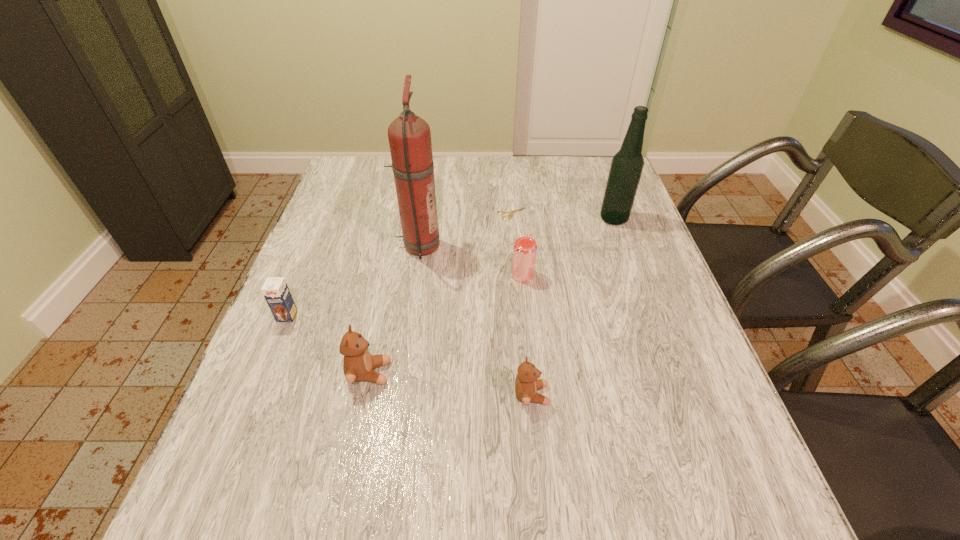
Identify the location of the left teddy bear. (358, 364).

Where is `the right teddy bear`? The width and height of the screenshot is (960, 540). the right teddy bear is located at coordinates (527, 384).

Identify the location of the leftmost object. Image resolution: width=960 pixels, height=540 pixels. (275, 290).

What are the coordinates of `the fifth farthest object` in the screenshot? It's located at (275, 290).

You are a GUI agent. You are given a task and a screenshot of the screen. Output one action in this format:
    pyautogui.click(x=<x>, y=<y>)
    Task: Click on the shears
    
    Given the screenshot: What is the action you would take?
    pyautogui.click(x=511, y=212)

Locate an element on the screen. The image size is (960, 540). the rightmost object is located at coordinates (627, 164).

Identify the location of alcohol. (627, 164).

Locate an element on the screen. Image resolution: width=960 pixels, height=540 pixels. the tallest object is located at coordinates (409, 136).

Find the location of a particular element. The width and height of the screenshot is (960, 540). fire extinguisher is located at coordinates (409, 136).

I want to click on beer can, so click(525, 248).